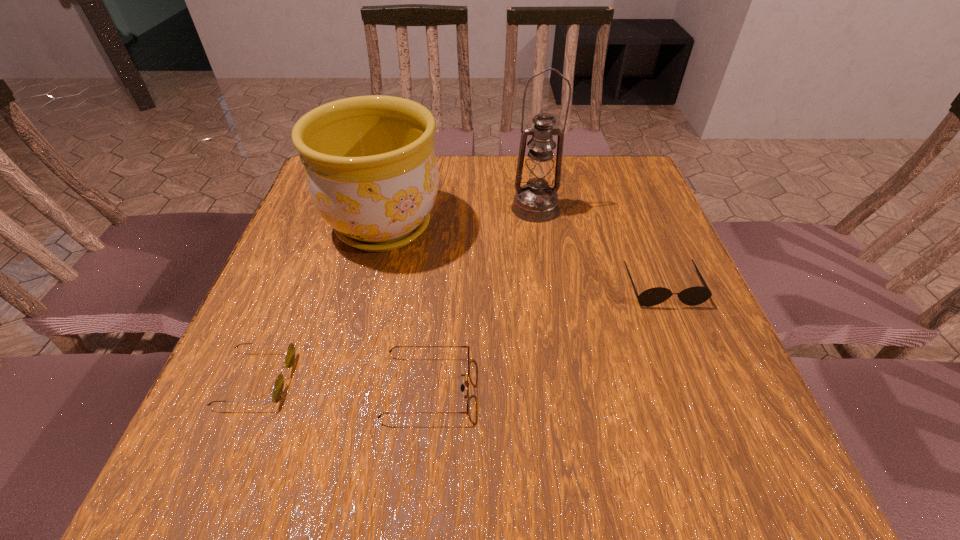
Image resolution: width=960 pixels, height=540 pixels. What are the coordinates of `vacant area between the fourth shortest object and the third farthest object` in the screenshot? It's located at (523, 256).

The image size is (960, 540). Find the location of `vacant space in between the rightmost object and the second tallest object`. vacant space in between the rightmost object and the second tallest object is located at coordinates (523, 256).

Where is `free space between the oil lamp and the rightmost sunglasses`? free space between the oil lamp and the rightmost sunglasses is located at coordinates (599, 248).

Identify the location of vacant space in between the leftmost sunglasses and the farthest sunglasses. Image resolution: width=960 pixels, height=540 pixels. (459, 333).

Where is `vacant point located between the rightmost object and the leftmost sunglasses`? Image resolution: width=960 pixels, height=540 pixels. vacant point located between the rightmost object and the leftmost sunglasses is located at coordinates (459, 333).

This screenshot has width=960, height=540. Identify the location of object that stands as the fourth closest to the leftmost sunglasses. (692, 296).

You are a GUI agent. You are given a task and a screenshot of the screen. Output one action in this format:
    pyautogui.click(x=<x>, y=<y>)
    Task: Click on the second closest object to the tallest object
    Image resolution: width=960 pixels, height=540 pixels.
    Given the screenshot: What is the action you would take?
    pyautogui.click(x=692, y=296)

What are the coordinates of `the closest sunglasses to the rightmost object` in the screenshot? It's located at (462, 387).

Select which sunglasses appears as the second closest to the second tallest object. Please provide its 2D coordinates. Your answer should be formatted as a tuple, i.e. [(x, y)], where the tuple contains the x and y coordinates of a point satisfying the conditions above.

[(462, 387)]

Identify the location of blank area in the image that satisfies the following two spatial constraints: 1. on the front side of the tallest object; 2. on the front-facing side of the second sunglasses from right to left. (562, 388).